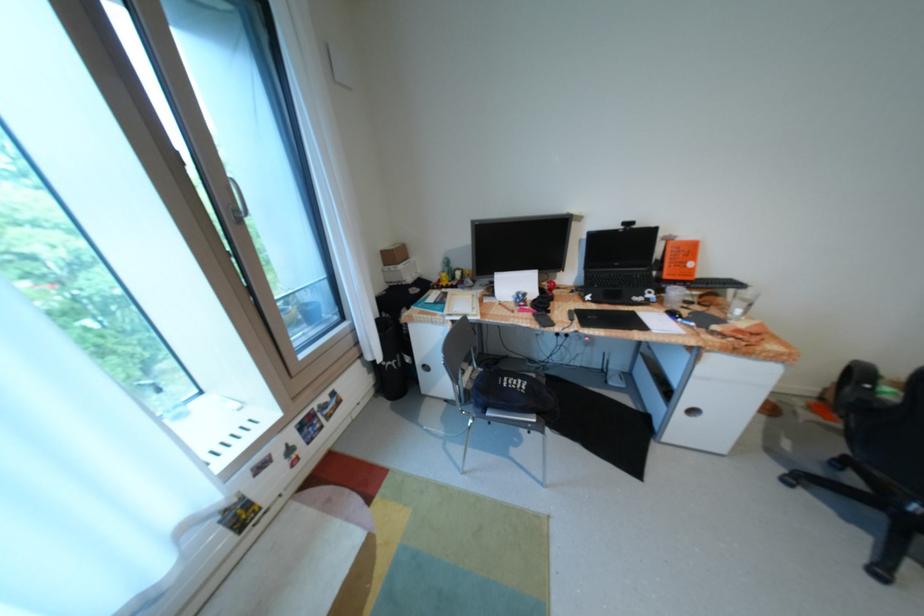
The location [397,265] corresponds to which object?

It refers to a small cardboard box.